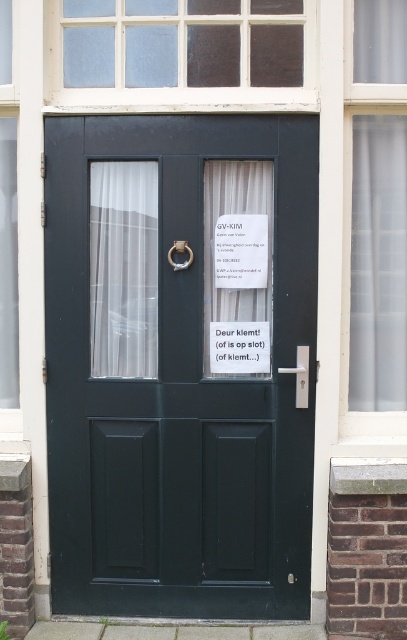
You are a delivery person trying to see through the translucent glass window at center to check if anyone is home. Can the white sheer curtain at center block your view?

The translucent glass window at center is larger in size than white sheer curtain at center, so the curtain cannot fully cover the window. Therefore, you can still see through the translucent glass window at center despite the curtain.

You are standing in front of the dark green door with the silver handle and lock. You notice two points marked on the door. Which of the two points, point (x=240, y=173) or point (x=269, y=355), is closer to you?

Point (x=240, y=173) is closer to the viewer than point (x=269, y=355).

You are standing in front of the dark green door with a traditional design. There are two points marked on the door. Which point is closer to you, point at coordinate (174, 420) or point at coordinate (107, 284)?

Point at coordinate (174, 420) is closer to you than point at coordinate (107, 284).